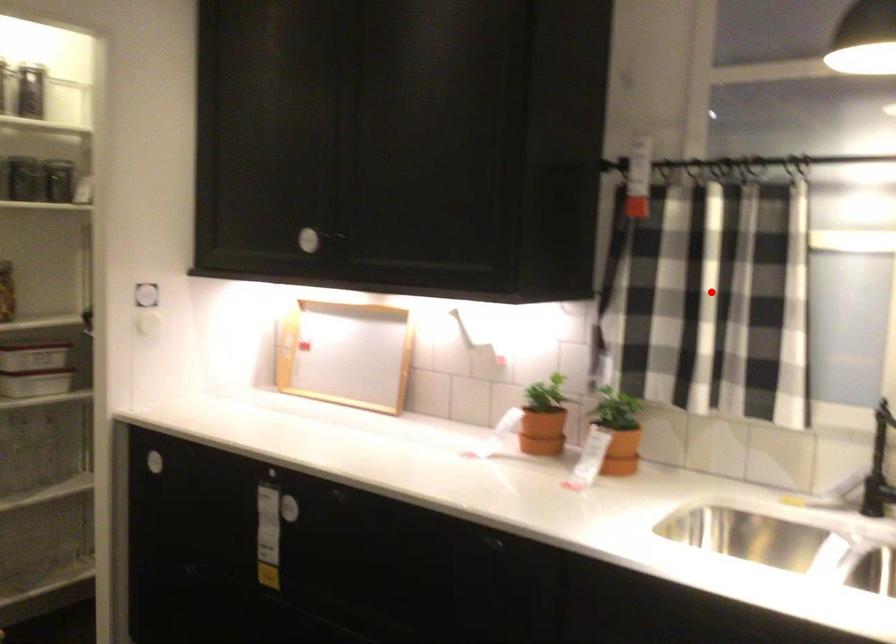
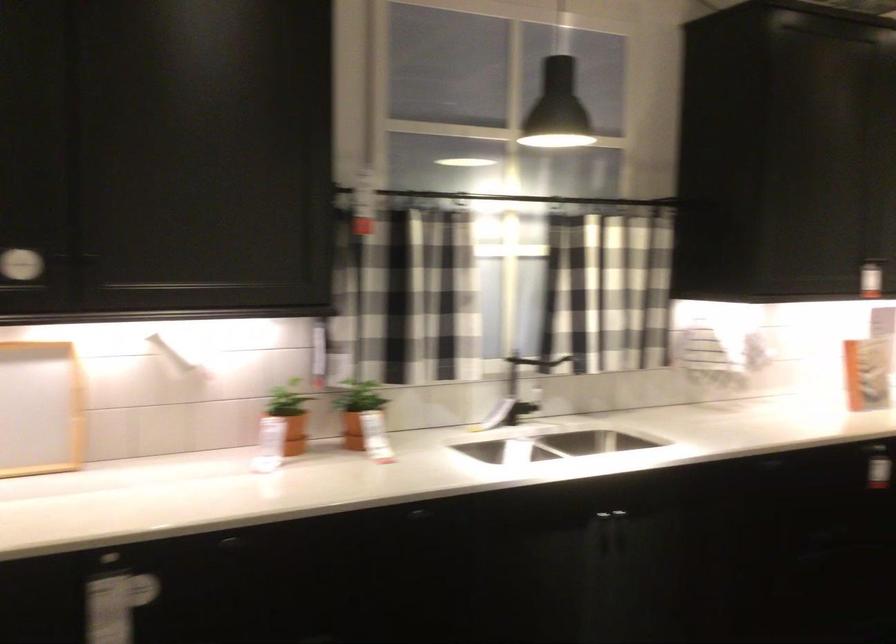
Question: I am providing you with two images of the same scene from different viewpoints. Image1 has a red point marked. In image2, the corresponding 3D location appears at what relative position? Reply with the corresponding letter.

Choices:
 (A) Closer
 (B) Farther

Answer: (B)